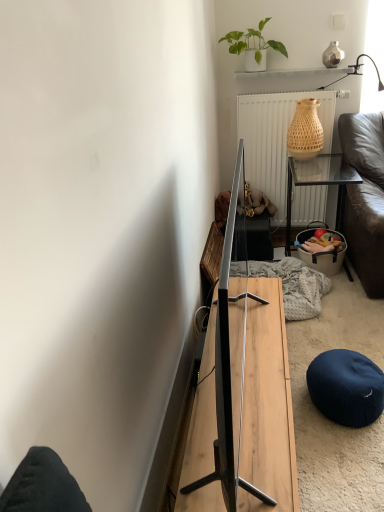
You are a GUI agent. You are given a task and a screenshot of the screen. Output one action in this format:
    pyautogui.click(x=<x>, y=<y>)
    Task: Click on the free space above white textured radiator at upper center (from a real-world perspective)
    Image resolution: width=384 pixels, height=512 pixels.
    Given the screenshot: What is the action you would take?
    pyautogui.click(x=288, y=89)